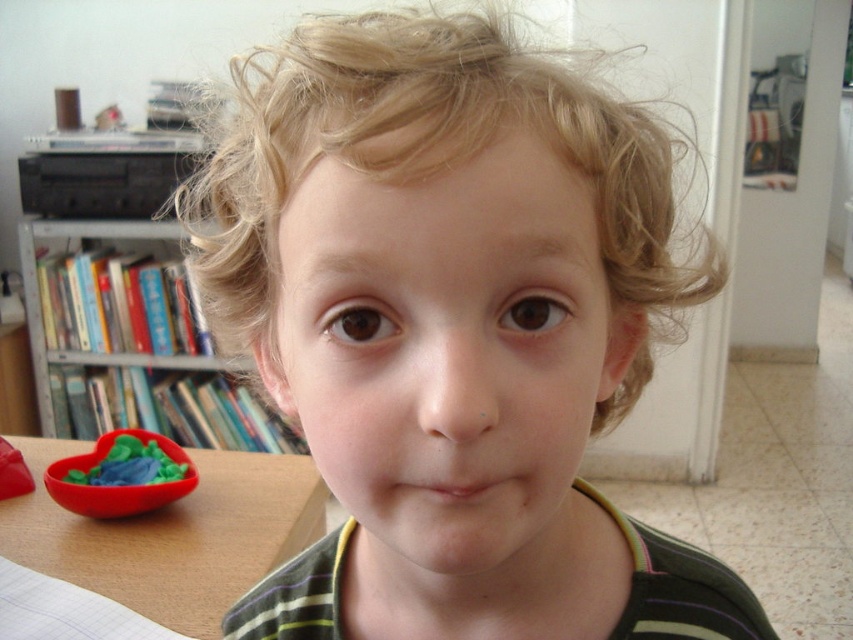
You are a photographer setting up a shot in this room. You need to position a light source to the left of the rubber heart at lower left. Will the light source be to the left or right of the smooth skin child at center?

The smooth skin child at center is to the right of the rubber heart at lower left. Therefore, positioning the light source to the left of the rubber heart at lower left would place it to the left of the smooth skin child at center as well.

You are a parent trying to locate two points in the room where you can place a small toy. The first point is at coordinates point (202,392) and the second is at point (180,557). Based on the scene, which point is closer to the bookshelf?

Point (180,557) is closer to the bookshelf because it is in front of point (202,392), which is behind it.